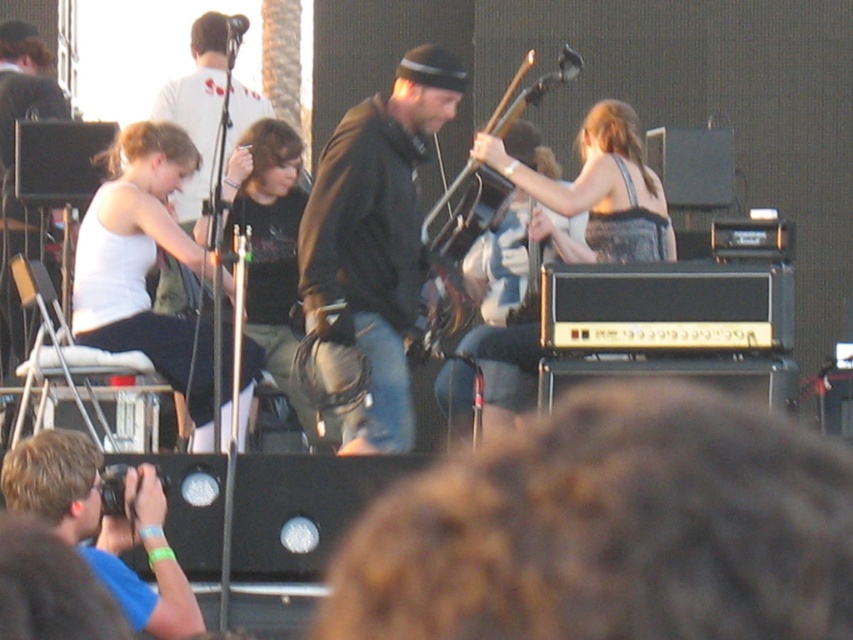
Consider the image. Which is below, white fabric tank top at left or metallic black guitar at center?

Positioned lower is white fabric tank top at left.

At what (x,y) coordinates should I click in order to perform the action: click on white fabric tank top at left. Please return your answer as a coordinate pair (x, y). The width and height of the screenshot is (853, 640). Looking at the image, I should click on pyautogui.click(x=136, y=250).

From the picture: Which is more to the left, dark brown leather jacket at center or white fabric tank top at left?

white fabric tank top at left is more to the left.

Is dark brown leather jacket at center taller than white fabric tank top at left?

No, dark brown leather jacket at center is not taller than white fabric tank top at left.

Between point (315, 268) and point (170, 353), which one is positioned in front?

Positioned in front is point (315, 268).

The width and height of the screenshot is (853, 640). I want to click on dark brown leather jacket at center, so click(372, 248).

How far apart are dark brown leather jacket at center and metallic black guitar at center?

dark brown leather jacket at center and metallic black guitar at center are 25.49 feet apart from each other.

Is dark brown leather jacket at center closer to camera compared to metallic black guitar at center?

That is True.

Is point (393, 96) positioned after point (541, 81)?

No, (393, 96) is closer to viewer.

Where is `dark brown leather jacket at center`? dark brown leather jacket at center is located at coordinates (372, 248).